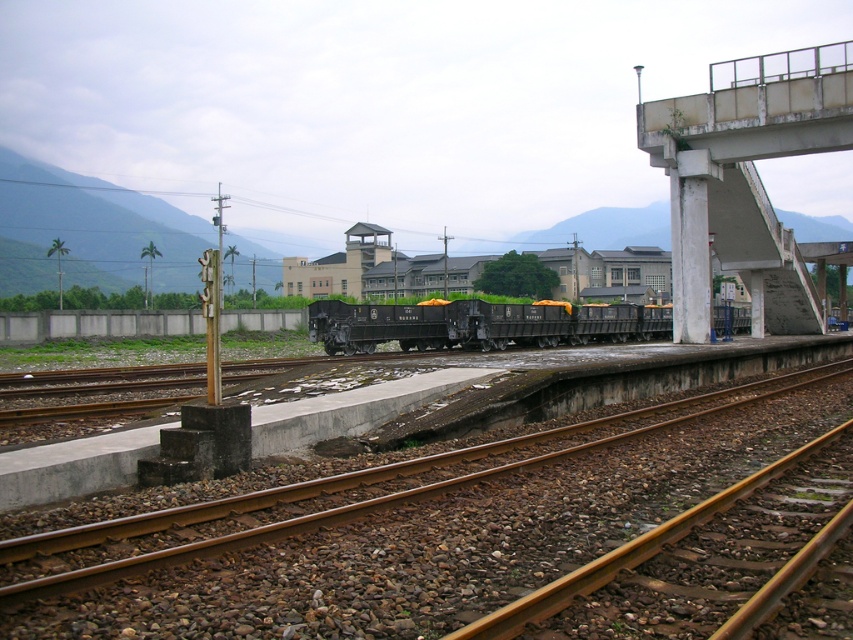
Question: Can you confirm if brown gravel track at center is positioned above concrete bridge at right?

Choices:
 (A) yes
 (B) no

Answer: (B)

Question: Which point is closer to the camera taking this photo?

Choices:
 (A) (346, 307)
 (B) (778, 109)
 (C) (288, 636)

Answer: (C)

Question: Does brown gravel track at center appear over black matte train at center?

Choices:
 (A) yes
 (B) no

Answer: (B)

Question: Does concrete bridge at right have a larger size compared to black matte train at center?

Choices:
 (A) no
 (B) yes

Answer: (B)

Question: Which of the following is the closest to the observer?

Choices:
 (A) concrete bridge at right
 (B) black matte train at center
 (C) brown gravel track at center

Answer: (C)

Question: Which point is farther to the camera?

Choices:
 (A) brown gravel track at center
 (B) black matte train at center
 (C) concrete bridge at right

Answer: (B)